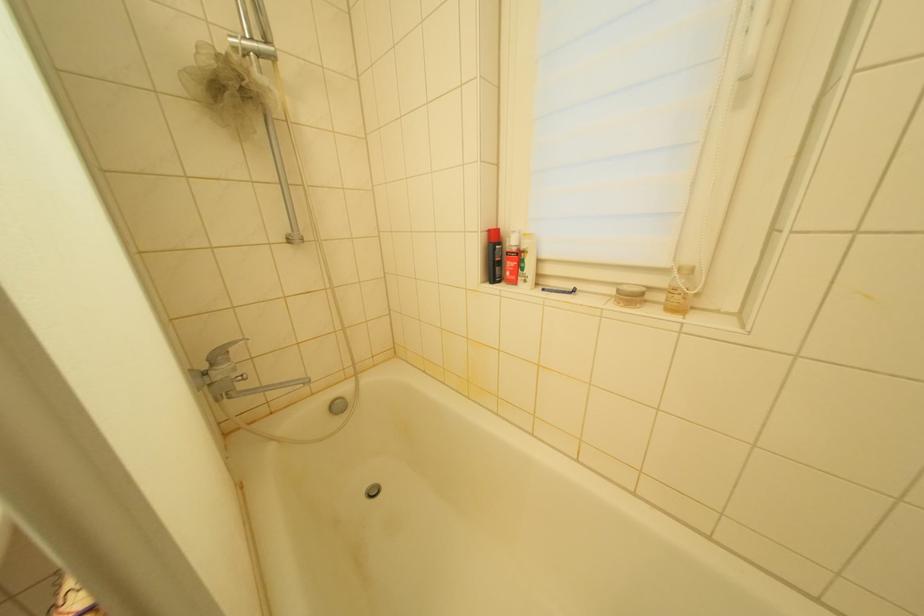
Where would you grasp the blue disposable razor? Please return your answer as a coordinate pair (x, y).

(558, 290)